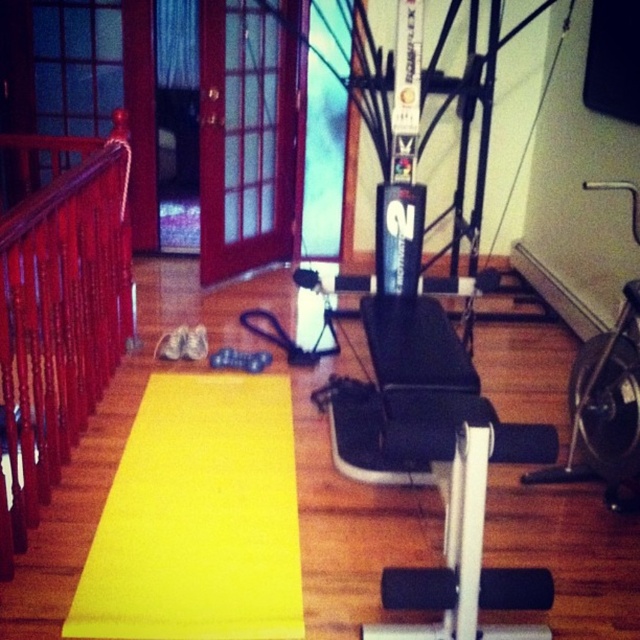
You are standing in the home gym and want to walk from the polished wood railing at left to the yellow rubber mat at center. Can you walk directly to it without moving any objects?

The polished wood railing at left is behind the yellow rubber mat at center, so you can walk directly to the yellow rubber mat at center without moving any objects because the railing is not blocking the path.

You are setting up a home gym and need to place a new exercise ball. The room has wooden flooring. Where should you place the exercise ball so it doesn not interfere with the yellow rubber mat at center?

The yellow rubber mat at center is located at point (198, 518). To avoid interference, place the exercise ball away from this coordinate, ensuring sufficient space around the mat for safe exercise.

You are a fitness instructor preparing for a class. You need to place a 30cm tall exercise ball between the yellow rubber mat at center and the polished wood railing at left. Can the exercise ball fit vertically between them?

The yellow rubber mat at center is not as tall as polished wood railing at left. Since the exercise ball is 30cm tall, it can fit vertically between them as long as the space between the two objects is at least 30cm. However, the exact distance isn not provided, so we can only confirm that the height difference allows vertical placement if space permits.